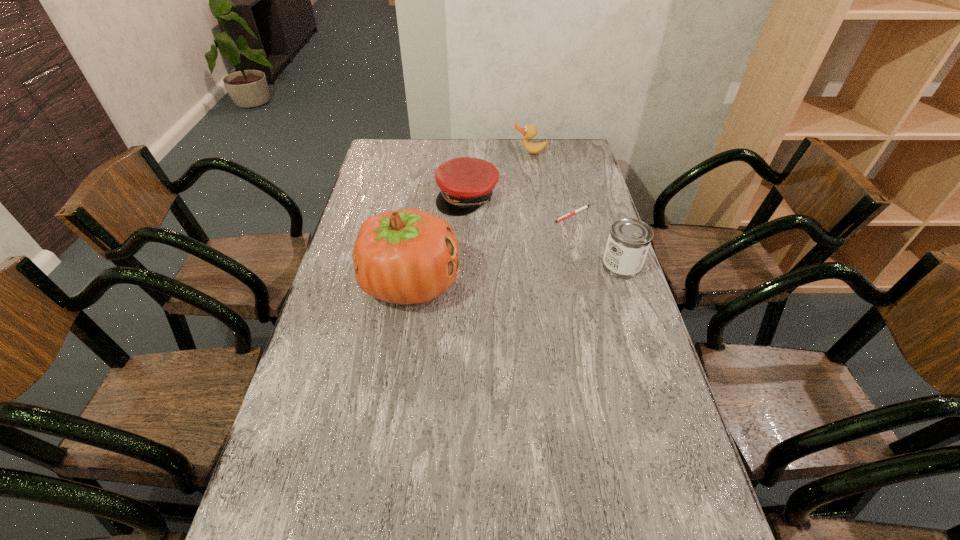
The image size is (960, 540). I want to click on vacant space situated on the clicker of the pen, so click(556, 250).

Find the location of `free space located on the clicker of the pen`. free space located on the clicker of the pen is located at coordinates (545, 273).

Where is `free spot located on the clicker of the pen`? Image resolution: width=960 pixels, height=540 pixels. free spot located on the clicker of the pen is located at coordinates (534, 297).

This screenshot has width=960, height=540. Find the location of `free spot located on the front-facing side of the cap`. free spot located on the front-facing side of the cap is located at coordinates (484, 263).

The image size is (960, 540). I want to click on vacant point located on the front-facing side of the cap, so click(482, 255).

Where is `vacant space positioned 0.310m on the front-facing side of the cap`? This screenshot has width=960, height=540. vacant space positioned 0.310m on the front-facing side of the cap is located at coordinates (487, 276).

This screenshot has height=540, width=960. What are the coordinates of `object present at the far edge` in the screenshot? It's located at point(529,131).

In order to click on object located at the left edge in this screenshot , I will do `click(408, 256)`.

You are a GUI agent. You are given a task and a screenshot of the screen. Output one action in this format:
    pyautogui.click(x=<x>, y=<y>)
    Task: Click on the can that is at the right edge
    This screenshot has width=960, height=540.
    Given the screenshot: What is the action you would take?
    pyautogui.click(x=629, y=239)

At what (x,y) coordinates should I click in order to perform the action: click on pen located at the right edge. Please return your answer as a coordinate pair (x, y). Looking at the image, I should click on (584, 207).